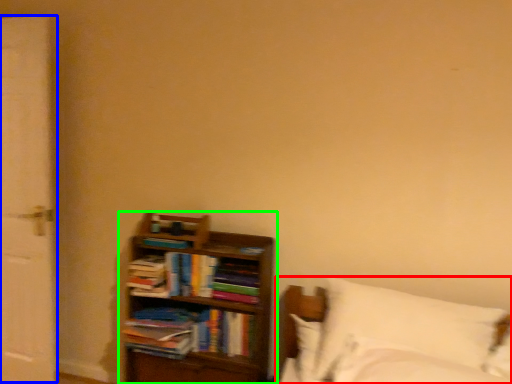
Question: Considering the real-world distances, which object is closest to bed (highlighted by a red box)? screen door (highlighted by a blue box) or bookcase (highlighted by a green box).

Choices:
 (A) screen door
 (B) bookcase

Answer: (B)